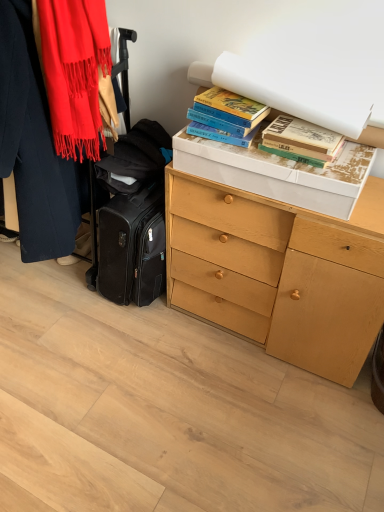
Find the location of a particular element. This screenshot has height=512, width=384. vacant point above hardcover books at upper right, arranged as the 1th book when viewed from the left (from a real-world perspective) is located at coordinates point(231,98).